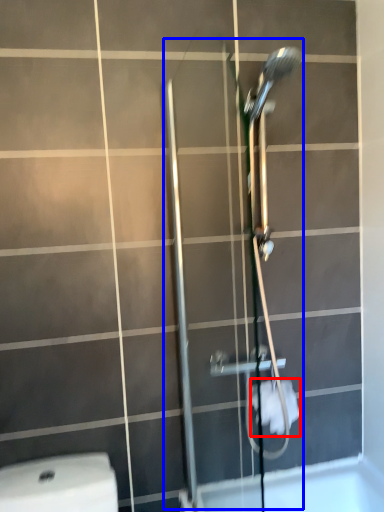
Question: Which object is closer to the camera taking this photo, toilet paper (highlighted by a red box) or shower door (highlighted by a blue box)?

Choices:
 (A) toilet paper
 (B) shower door

Answer: (B)